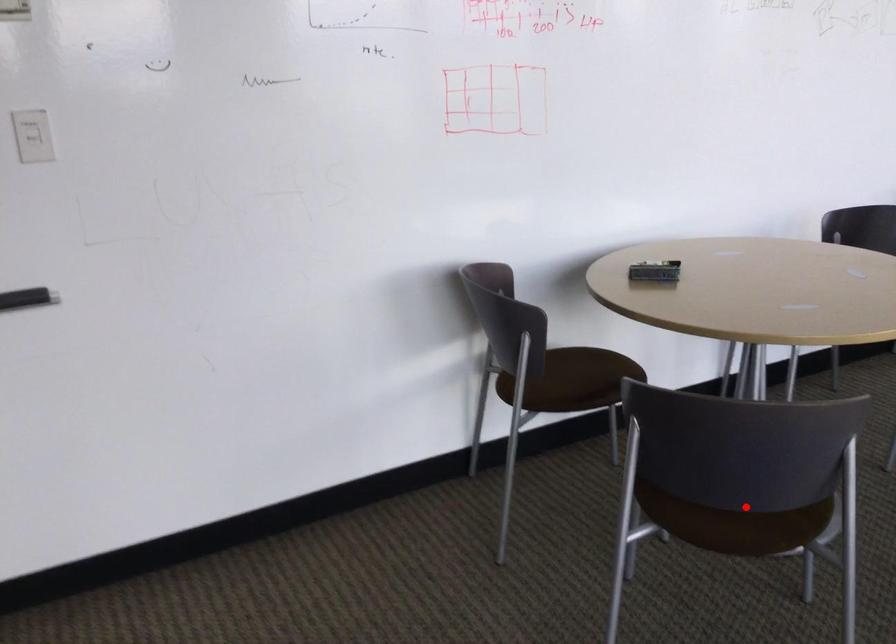
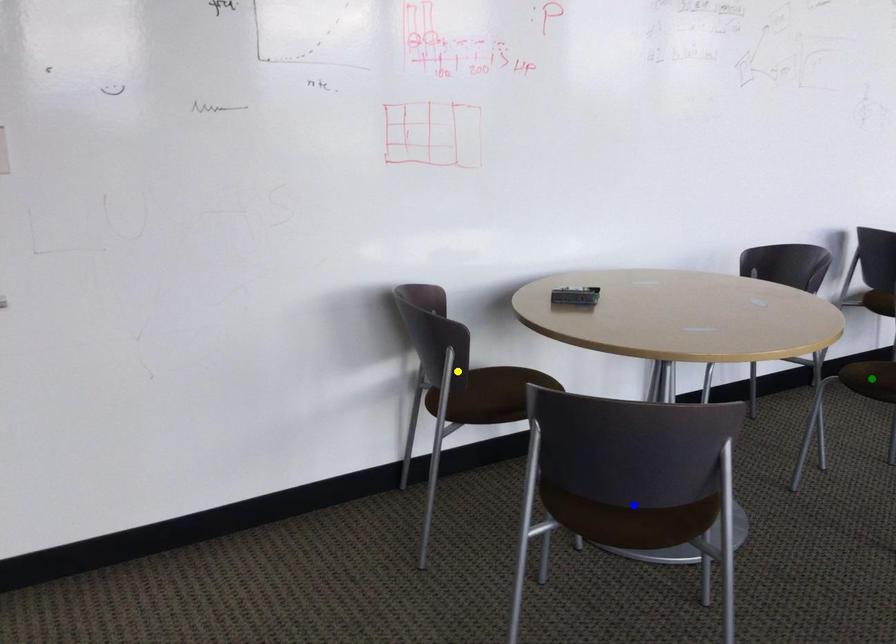
Question: I am providing you with two images of the same scene from different viewpoints. A red point is marked on the first image. You are given multiple points on the second image. Which point in image 2 represents the same 3d spot as the red point in image 1?

Choices:
 (A) green point
 (B) blue point
 (C) yellow point

Answer: (B)